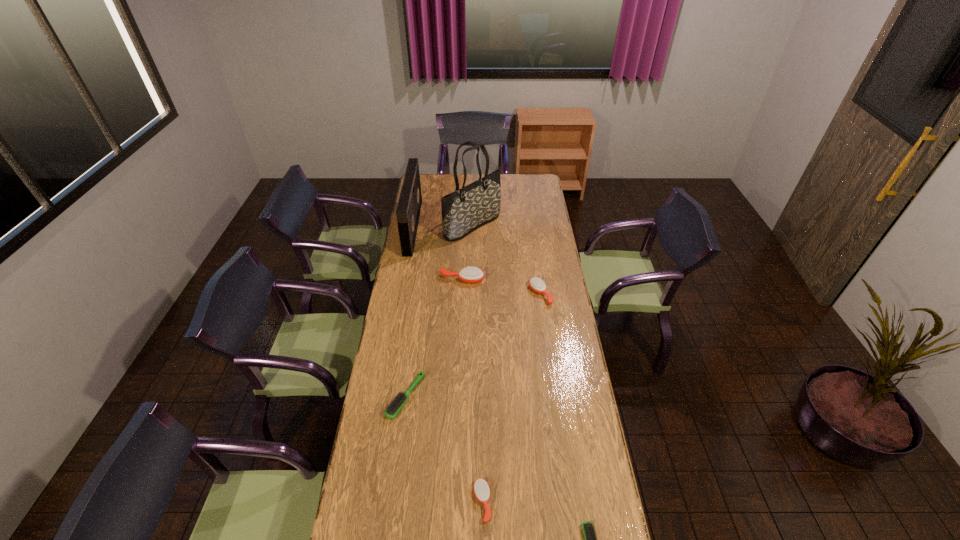
The height and width of the screenshot is (540, 960). Find the location of `orange hairbrush that is the second nearest to the videotape`. orange hairbrush that is the second nearest to the videotape is located at coordinates (536, 284).

Locate an element on the screen. The image size is (960, 540). light hairbrush that is the second nearest to the tallest hairbrush is located at coordinates (589, 532).

You are a GUI agent. You are given a task and a screenshot of the screen. Output one action in this format:
    pyautogui.click(x=<x>, y=<y>)
    Task: Click on the vacant space that satisfies the following two spatial constraints: 1. on the back side of the nearest orange hairbrush; 2. on the left side of the fourth shortest object
    This screenshot has height=540, width=960.
    Given the screenshot: What is the action you would take?
    pyautogui.click(x=481, y=294)

This screenshot has width=960, height=540. I want to click on free space that satisfies the following two spatial constraints: 1. on the front side of the sixth shortest object; 2. on the right side of the biggest orange hairbrush, so click(x=403, y=280).